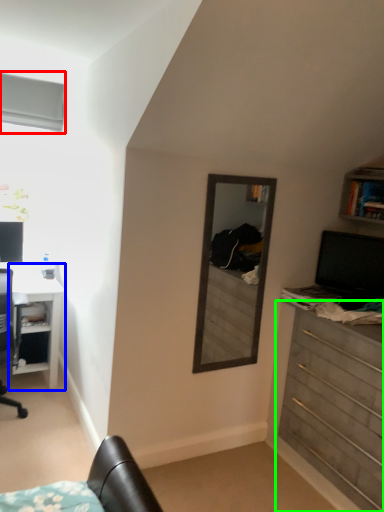
Question: Which is nearer to the window (highlighted by a red box)? desk (highlighted by a blue box) or chest of drawers (highlighted by a green box).

Choices:
 (A) desk
 (B) chest of drawers

Answer: (A)